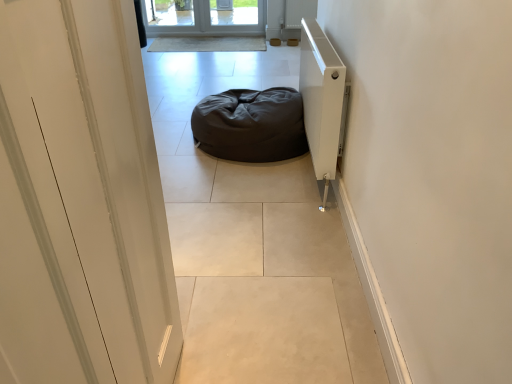
What is the approximate height of white glossy door at left?

The height of white glossy door at left is 1.25 meters.

Locate an element on the screen. This screenshot has width=512, height=384. dark brown fabric bean bag at center is located at coordinates (251, 125).

Looking at the image, does white glossy door at left seem bigger or smaller compared to dark matte bean bag at center?

Clearly, white glossy door at left is smaller in size than dark matte bean bag at center.

Does white glossy door at left have a greater height compared to dark matte bean bag at center?

Yes, white glossy door at left is taller than dark matte bean bag at center.

Is dark matte bean bag at center inside white glossy door at left?

No.

Is white matte radiator at right oriented away from dark matte bean bag at center?

white matte radiator at right does not have its back to dark matte bean bag at center.

From a real-world perspective, is white matte radiator at right positioned above or below dark matte bean bag at center?

Clearly, from a real-world perspective, white matte radiator at right is above dark matte bean bag at center.

From the image's perspective, which object appears higher, white matte radiator at right or dark matte bean bag at center?

dark matte bean bag at center.

Which is more to the right, white glossy door at left or white matte radiator at right?

Positioned to the right is white matte radiator at right.

Considering the relative sizes of white glossy door at left and white matte radiator at right in the image provided, is white glossy door at left thinner than white matte radiator at right?

Incorrect, the width of white glossy door at left is not less than that of white matte radiator at right.

Does white glossy door at left have a larger size compared to white matte radiator at right?

Actually, white glossy door at left might be smaller than white matte radiator at right.

Considering the sizes of objects white glossy door at left and white matte radiator at right in the image provided, who is taller, white glossy door at left or white matte radiator at right?

With more height is white glossy door at left.

Is dark brown fabric bean bag at center completely or partially outside of white glossy door at left?

dark brown fabric bean bag at center is positioned outside white glossy door at left.

Which is behind, dark brown fabric bean bag at center or white glossy door at left?

dark brown fabric bean bag at center is more distant.

In the scene shown: Considering the sizes of dark brown fabric bean bag at center and white glossy door at left in the image, is dark brown fabric bean bag at center bigger or smaller than white glossy door at left?

dark brown fabric bean bag at center is bigger than white glossy door at left.

Is dark brown fabric bean bag at center in contact with white glossy door at left?

dark brown fabric bean bag at center and white glossy door at left are not in contact.

Which is correct: dark brown fabric bean bag at center is inside dark matte bean bag at center, or outside of it?

dark brown fabric bean bag at center is not inside dark matte bean bag at center, it's outside.

Is point (279, 135) positioned after point (207, 376)?

Yes, it is behind point (207, 376).

Is dark brown fabric bean bag at center to the left or to the right of dark matte bean bag at center in the image?

In the image, dark brown fabric bean bag at center appears on the right side of dark matte bean bag at center.

In the scene shown: What's the angular difference between dark brown fabric bean bag at center and dark matte bean bag at center's facing directions?

The angular difference between dark brown fabric bean bag at center and dark matte bean bag at center is 91.3 degrees.

Considering the sizes of dark brown fabric bean bag at center and white matte radiator at right in the image, is dark brown fabric bean bag at center bigger or smaller than white matte radiator at right?

Considering their sizes, dark brown fabric bean bag at center takes up more space than white matte radiator at right.

Who is more distant, dark brown fabric bean bag at center or white matte radiator at right?

Positioned behind is dark brown fabric bean bag at center.

Is dark brown fabric bean bag at center to the right of white matte radiator at right from the viewer's perspective?

Incorrect, dark brown fabric bean bag at center is not on the right side of white matte radiator at right.

From the picture: From a real-world perspective, is dark brown fabric bean bag at center above or below white matte radiator at right?

dark brown fabric bean bag at center is situated lower than white matte radiator at right in the real world.

Is white matte radiator at right further to camera compared to dark brown fabric bean bag at center?

No, white matte radiator at right is closer to the viewer.

From a real-world perspective, who is located lower, white matte radiator at right or dark brown fabric bean bag at center?

dark brown fabric bean bag at center, from a real-world perspective.

Is dark brown fabric bean bag at center surrounded by white matte radiator at right?

No, dark brown fabric bean bag at center is not inside white matte radiator at right.

Find the location of `path behind the white glossy door at left`. path behind the white glossy door at left is located at coordinates (254, 243).

Where is `path on the left of white matte radiator at right`? path on the left of white matte radiator at right is located at coordinates (254, 243).

Which object lies nearer to the anchor point white matte radiator at right, dark brown fabric bean bag at center or white glossy door at left?

The object closer to white matte radiator at right is dark brown fabric bean bag at center.

Looking at this image, considering their positions, is dark brown fabric bean bag at center positioned further to dark matte bean bag at center than white matte radiator at right?

white matte radiator at right is positioned further to the anchor dark matte bean bag at center.

Which object lies further to the anchor point white glossy door at left, white matte radiator at right or dark matte bean bag at center?

white matte radiator at right.

Considering their positions, is dark brown fabric bean bag at center positioned closer to dark matte bean bag at center than white glossy door at left?

Based on the image, dark brown fabric bean bag at center appears to be nearer to dark matte bean bag at center.

Estimate the real-world distances between objects in this image. Which object is closer to dark brown fabric bean bag at center, white glossy door at left or dark matte bean bag at center?

dark matte bean bag at center is positioned closer to the anchor dark brown fabric bean bag at center.

When comparing their distances from white matte radiator at right, does white glossy door at left or dark matte bean bag at center seem closer?

dark matte bean bag at center lies closer to white matte radiator at right than the other object.

Considering their positions, is dark matte bean bag at center positioned closer to dark brown fabric bean bag at center than white matte radiator at right?

dark matte bean bag at center.

Considering their positions, is dark matte bean bag at center positioned further to white matte radiator at right than white glossy door at left?

The object further to white matte radiator at right is white glossy door at left.

You are a GUI agent. You are given a task and a screenshot of the screen. Output one action in this format:
    pyautogui.click(x=<x>, y=<y>)
    Task: Click on the radiator located between white glossy door at left and dark brown fabric bean bag at center in the depth direction
    
    Given the screenshot: What is the action you would take?
    pyautogui.click(x=321, y=100)

Locate an element on the screen. The width and height of the screenshot is (512, 384). path positioned between white glossy door at left and white matte radiator at right from near to far is located at coordinates (254, 243).

Find the location of a particular element. The width and height of the screenshot is (512, 384). path positioned between white glossy door at left and dark brown fabric bean bag at center from near to far is located at coordinates (254, 243).

Identify the location of radiator between dark matte bean bag at center and dark brown fabric bean bag at center in the front-back direction. The image size is (512, 384). (321, 100).